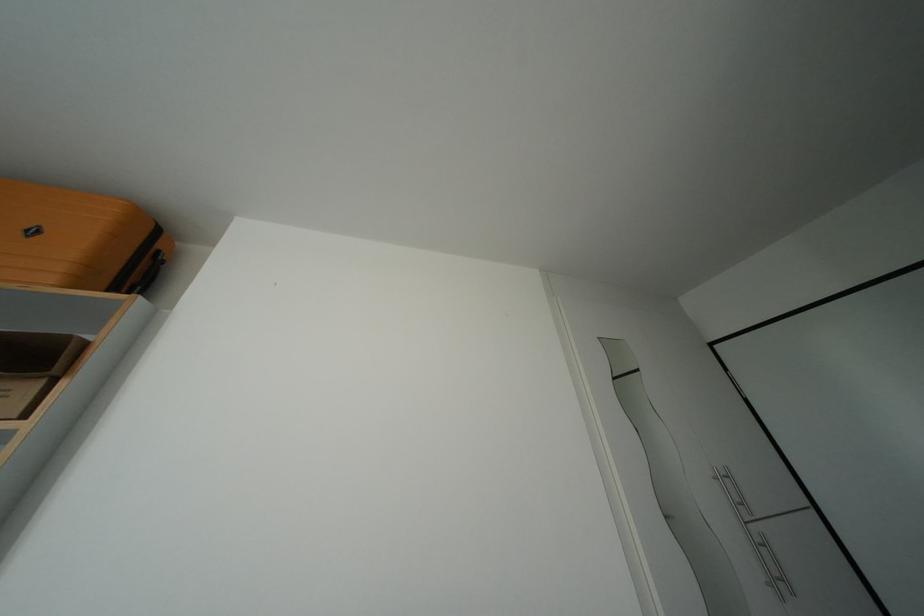
The location [32,368] corresponds to which object?

It refers to a cardboard box.